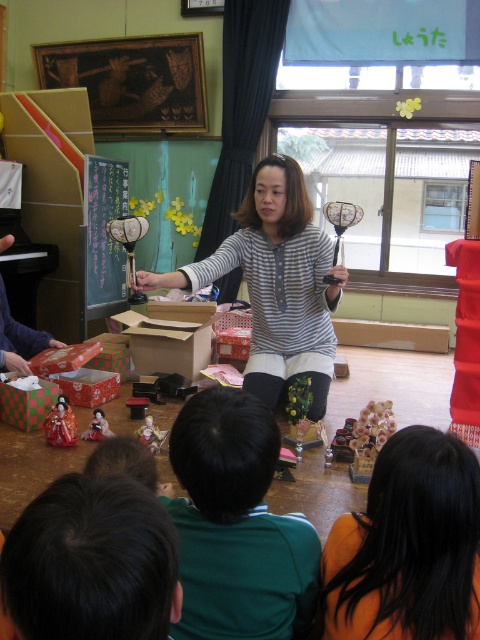
Is matte wooden doll at lower center to the right of matte plastic doll at lower left from the viewer's perspective?

Correct, you'll find matte wooden doll at lower center to the right of matte plastic doll at lower left.

Can you confirm if matte wooden doll at lower center is wider than matte plastic doll at lower left?

Incorrect, matte wooden doll at lower center's width does not surpass matte plastic doll at lower left's.

Is point (145, 440) positioned behind point (105, 435)?

No, (145, 440) is in front of (105, 435).

I want to click on matte wooden doll at lower center, so click(151, 435).

Which is more to the right, striped fabric at center or matte plastic doll at lower left?

From the viewer's perspective, striped fabric at center appears more on the right side.

Who is more forward, (323, 234) or (93, 428)?

Point (323, 234) is more forward.

Locate an element on the screen. The width and height of the screenshot is (480, 640). striped fabric at center is located at coordinates (276, 284).

Is point (177, 445) more distant than point (201, 352)?

No, (177, 445) is closer to viewer.

Is green fabric shirt at lower center to the left of cardboard box at center from the viewer's perspective?

Incorrect, green fabric shirt at lower center is not on the left side of cardboard box at center.

Does point (276, 538) come in front of point (168, 324)?

Yes.

This screenshot has width=480, height=640. What are the coordinates of `green fabric shirt at lower center` in the screenshot? It's located at (237, 525).